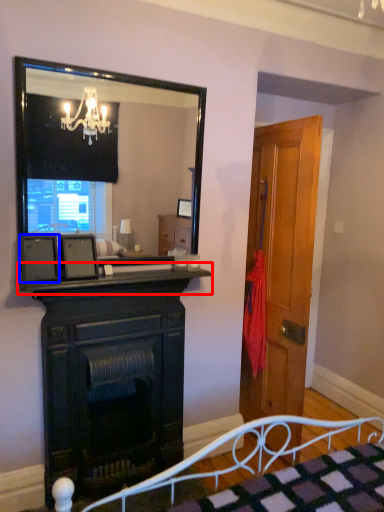
Question: Which object is closer to the camera taking this photo, mantle (highlighted by a red box) or picture frame (highlighted by a blue box)?

Choices:
 (A) mantle
 (B) picture frame

Answer: (A)